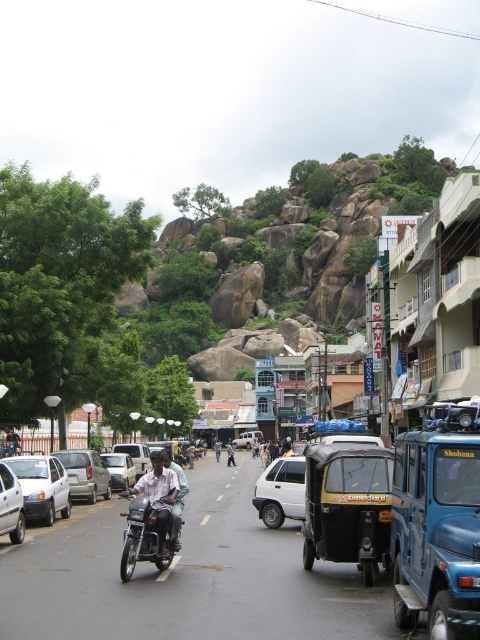
Question: Is white fabric person at center further to camera compared to black plastic motorcycle at center?

Choices:
 (A) no
 (B) yes

Answer: (B)

Question: Which point is farther to the camera?

Choices:
 (A) (84, 468)
 (B) (155, 548)
 (C) (12, 490)

Answer: (A)

Question: Estimate the real-world distances between objects in this image. Which object is farther from the white fabric person at center?

Choices:
 (A) black plastic motorcycle at center
 (B) white matte car at lower left
 (C) silver metallic car at center
 (D) silver metallic car at left

Answer: (A)

Question: Does shiny black motorcycle at center have a larger size compared to silver metallic car at left?

Choices:
 (A) no
 (B) yes

Answer: (B)

Question: Which object appears farthest from the camera in this image?

Choices:
 (A) white fabric person at center
 (B) light brown leather jacket at center
 (C) silver metallic car at center

Answer: (A)

Question: Does white matte car at lower left have a larger size compared to white matte hatchback at center?

Choices:
 (A) no
 (B) yes

Answer: (B)